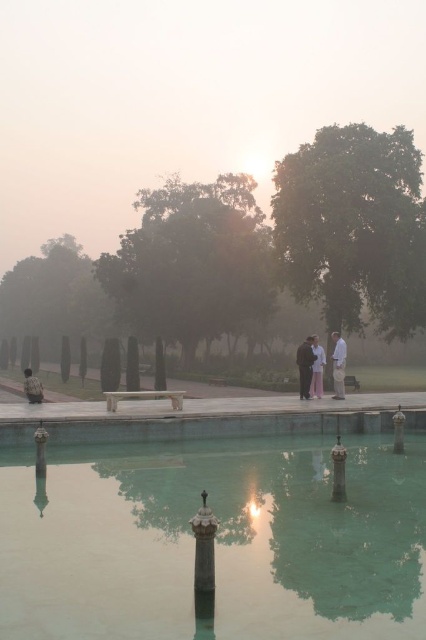
You are standing on the curved walkway and see two people wearing a dark brown suit at center and white cotton pants at center. Which clothing item is positioned to the right?

The dark brown suit at center is to the right of the white cotton pants at center.

You are standing at the entrance of the garden and want to reach the green marble swimming pool at center. According to the coordinates provided, in which direction should you walk to reach it?

The green marble swimming pool at center is located at point 0.845 on the x axis and 0.507 on the y axis, so you should walk towards the right direction to reach it since the x coordinate is higher than 0.5.

You are standing at the wooden bench and want to walk to the group of people near the edge of the pool. There are two points marked on your path. Which point should you reach first, point (204, 586) or point (322, 364)?

You should reach point (204, 586) first because it is in front of point (322, 364) along your path.